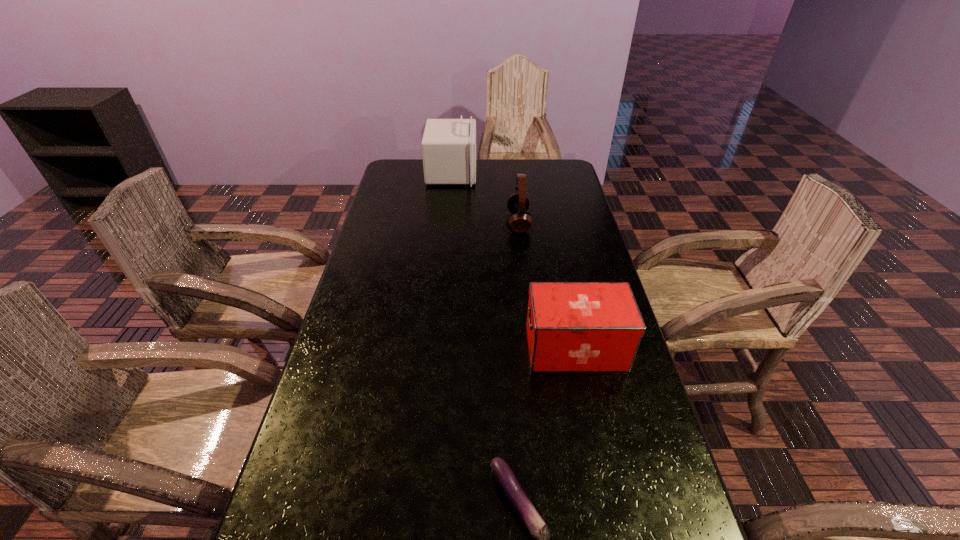
This screenshot has height=540, width=960. Find the location of `free spot located 0.340m on the handle side of the right first-aid kit`. free spot located 0.340m on the handle side of the right first-aid kit is located at coordinates click(x=394, y=348).

This screenshot has width=960, height=540. In order to click on vacant point located 0.240m on the handle side of the right first-aid kit in this screenshot , I will do `click(433, 348)`.

The height and width of the screenshot is (540, 960). Identify the location of object positioned at the far edge. [x=449, y=145].

Where is `object that is at the right edge`? The width and height of the screenshot is (960, 540). object that is at the right edge is located at coordinates (571, 326).

At what (x,y) coordinates should I click in order to perform the action: click on vacant space at the far edge of the desktop. Please return your answer as a coordinate pair (x, y). The image size is (960, 540). Looking at the image, I should click on (513, 160).

In the image, there is a desktop. Where is `vacant space at the left edge`? This screenshot has height=540, width=960. vacant space at the left edge is located at coordinates (346, 404).

At what (x,y) coordinates should I click in order to perform the action: click on free space at the right edge of the desktop. Please return your answer as a coordinate pair (x, y). Image resolution: width=960 pixels, height=540 pixels. Looking at the image, I should click on (588, 217).

In the image, there is a desktop. Where is `vacant space at the far left corner`? This screenshot has height=540, width=960. vacant space at the far left corner is located at coordinates (419, 185).

Image resolution: width=960 pixels, height=540 pixels. I want to click on vacant space at the far right corner of the desktop, so [x=546, y=160].

This screenshot has height=540, width=960. I want to click on free space between the third farthest object and the farther first-aid kit, so click(514, 260).